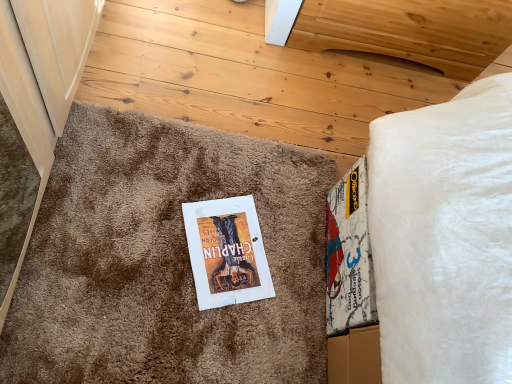
Question: From the image's perspective, is white paper book at center located beneath brown shaggy carpet at center?

Choices:
 (A) yes
 (B) no

Answer: (A)

Question: Is white paper book at center far away from brown shaggy carpet at center?

Choices:
 (A) no
 (B) yes

Answer: (A)

Question: Is white paper book at center wider than brown shaggy carpet at center?

Choices:
 (A) no
 (B) yes

Answer: (A)

Question: Is white paper book at center behind brown shaggy carpet at center?

Choices:
 (A) no
 (B) yes

Answer: (B)

Question: Is white paper book at center beside brown shaggy carpet at center?

Choices:
 (A) yes
 (B) no

Answer: (B)

Question: Is white paper book at center oriented towards brown shaggy carpet at center?

Choices:
 (A) yes
 (B) no

Answer: (A)

Question: From a real-world perspective, is brown shaggy carpet at center positioned under natural wood headboard at upper center based on gravity?

Choices:
 (A) yes
 (B) no

Answer: (A)

Question: Considering the relative positions of brown shaggy carpet at center and natural wood headboard at upper center in the image provided, is brown shaggy carpet at center in front of natural wood headboard at upper center?

Choices:
 (A) yes
 (B) no

Answer: (A)

Question: Is brown shaggy carpet at center taller than natural wood headboard at upper center?

Choices:
 (A) yes
 (B) no

Answer: (B)

Question: Is brown shaggy carpet at center bigger than natural wood headboard at upper center?

Choices:
 (A) no
 (B) yes

Answer: (A)

Question: Is the surface of brown shaggy carpet at center in direct contact with natural wood headboard at upper center?

Choices:
 (A) no
 (B) yes

Answer: (A)

Question: From the image's perspective, is brown shaggy carpet at center located beneath natural wood headboard at upper center?

Choices:
 (A) no
 (B) yes

Answer: (B)

Question: Would you say brown shaggy carpet at center contains white paper book at center?

Choices:
 (A) no
 (B) yes

Answer: (B)